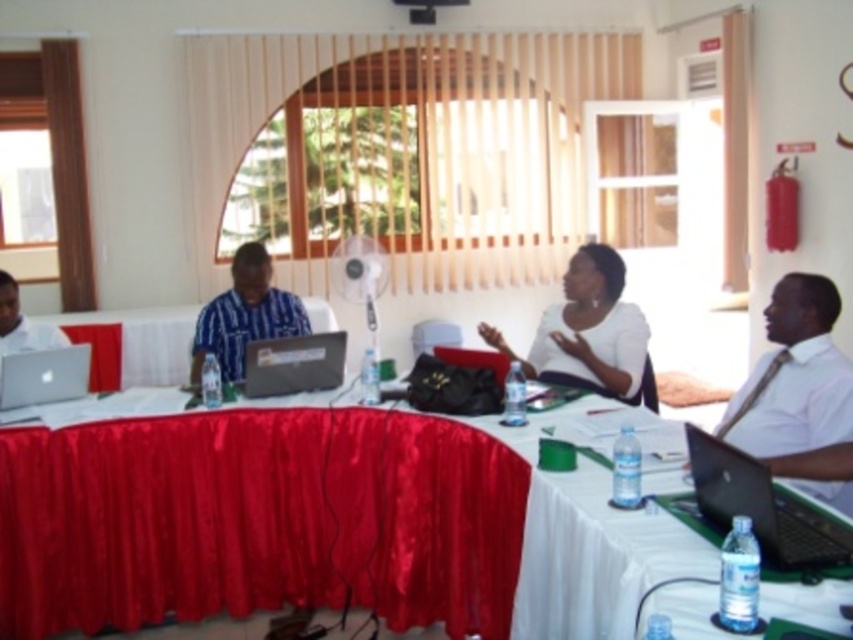
You are organizing a presentation and need to know which laptop to use for the projector. The silver metallic laptop at lower left is smaller than the matte silver laptop at left. Which laptop has a higher chance of having a VGA port for the projector connection?

The matte silver laptop at left is larger and more likely to have a VGA port for the projector connection since it is bigger than the silver metallic laptop at lower left.

In the conference room scene, there is a person in a white matte shirt at center. Where exactly is this person located in terms of coordinates?

The white matte shirt at center is located at coordinates point (595, 332).